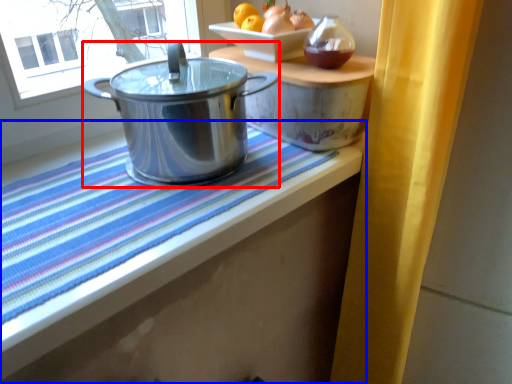
Question: Among these objects, which one is farthest to the camera, kitchen appliance (highlighted by a red box) or table (highlighted by a blue box)?

Choices:
 (A) kitchen appliance
 (B) table

Answer: (A)